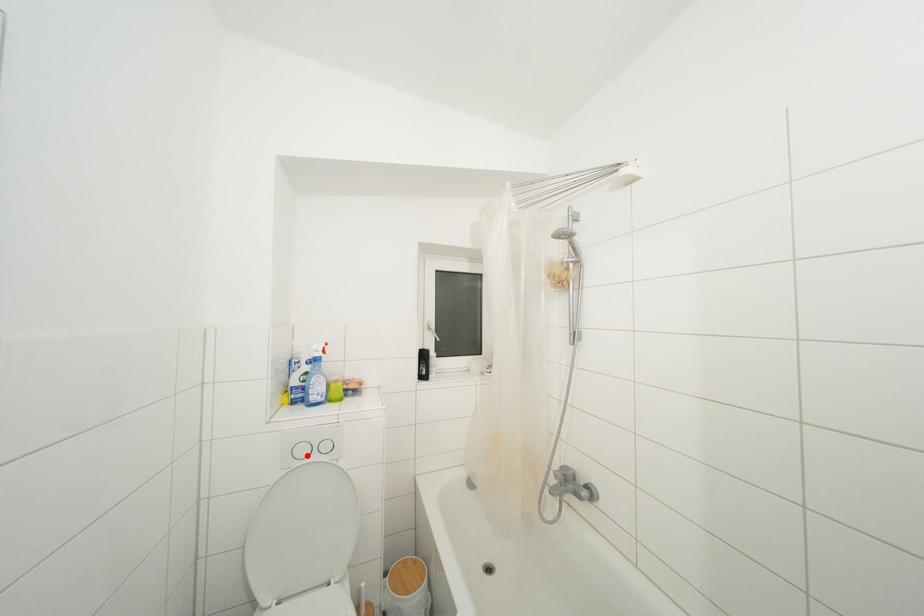
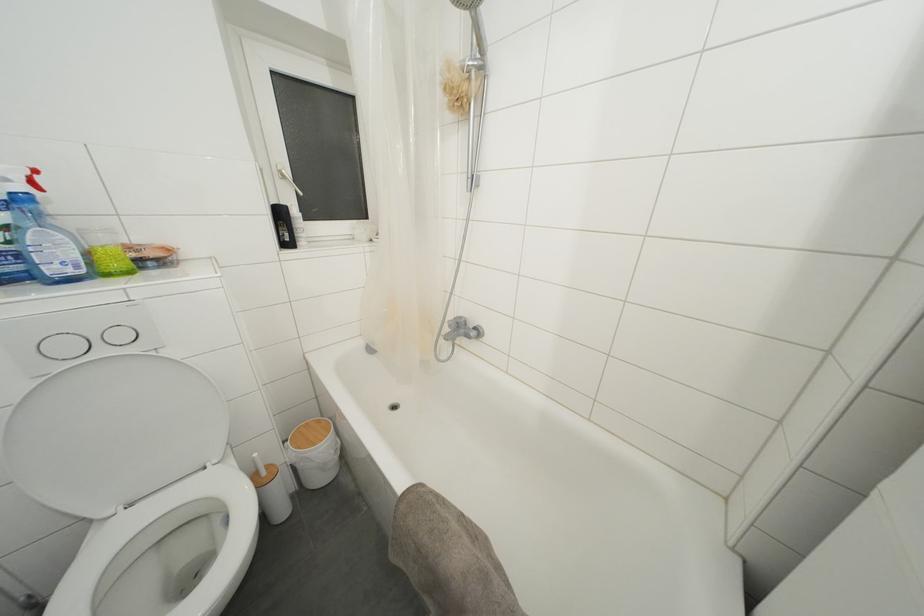
Question: I am providing you with two images of the same scene from different viewpoints. Given a red point in image1, look at the same physical point in image2. Is it:

Choices:
 (A) Closer to the viewpoint
 (B) Farther from the viewpoint

Answer: (B)